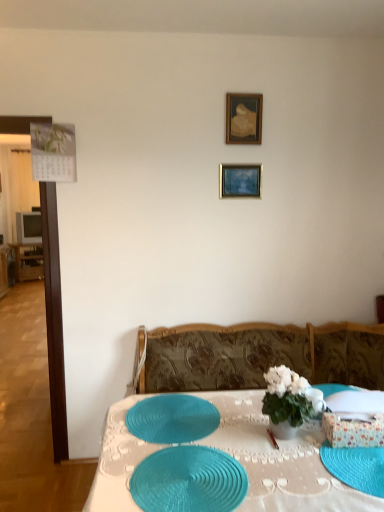
Question: Based on their sizes in the image, would you say teal woven placemat at center, the first tableware in the front-to-back sequence, is bigger or smaller than gold metallic picture frame at upper center, acting as the first picture frame starting from the bottom?

Choices:
 (A) big
 (B) small

Answer: (A)

Question: Considering their positions, is teal woven placemat at center, the first tableware in the front-to-back sequence, located in front of or behind gold metallic picture frame at upper center, the 2th picture frame in the top-to-bottom sequence?

Choices:
 (A) behind
 (B) front

Answer: (B)

Question: Which of these objects is positioned closest to the gold metallic picture frame at upper center, the 2th picture frame in the top-to-bottom sequence?

Choices:
 (A) white glossy vase at center
 (B) teal woven placemat at center
 (C) matte gray television at left
 (D) blue textured glass plate at lower right
 (E) teal woven placemat at center, the 1th tableware viewed from the back

Answer: (A)

Question: Estimate the real-world distances between objects in this image. Which object is farther from the wooden picture frame at upper center, which ranks as the first picture frame in top-to-bottom order?

Choices:
 (A) teal woven placemat at center, positioned as the second tableware in back-to-front order
 (B) teal woven placemat at center, which ranks as the 2th tableware in front-to-back order
 (C) white glossy vase at center
 (D) teal woven placemat at center
 (E) matte gray television at left

Answer: (E)